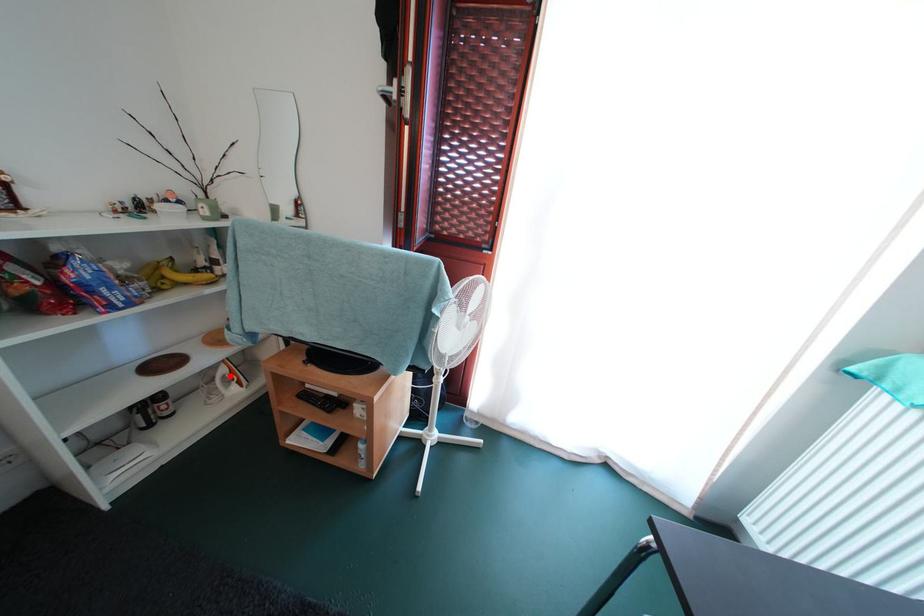
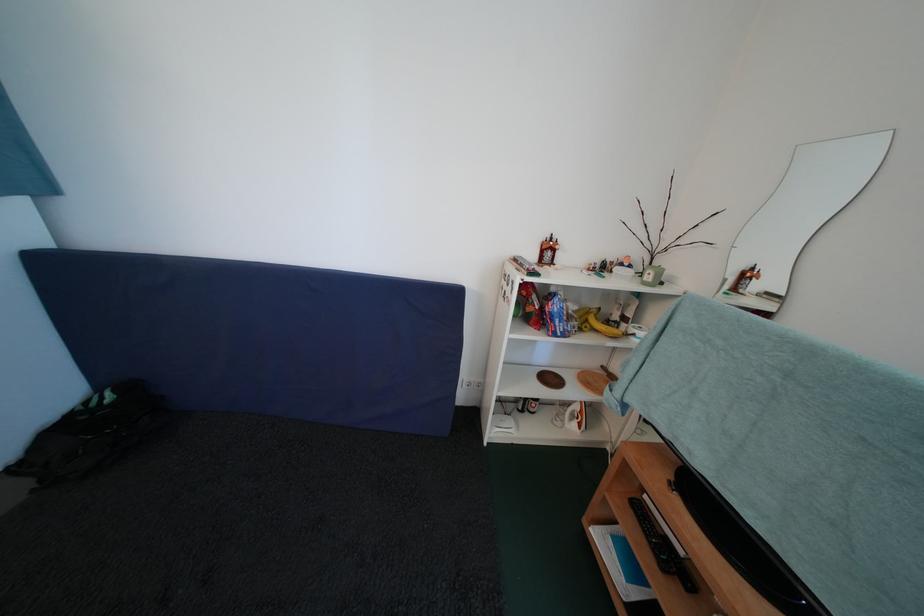
Question: I am providing you with two images of the same scene from different viewpoints. A red point is shown in image1. For the corresponding object point in image2, is it positioned nearer or farther from the camera?

Choices:
 (A) Nearer
 (B) Farther

Answer: (B)